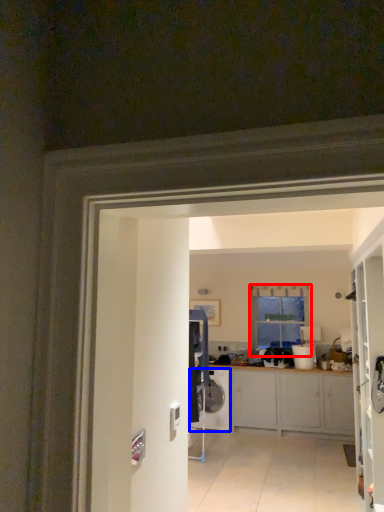
Question: Which of the following is the closest to the observer, window (highlighted by a red box) or washing machine (highlighted by a blue box)?

Choices:
 (A) window
 (B) washing machine

Answer: (B)